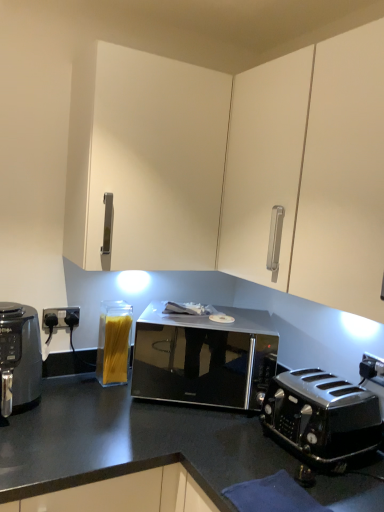
Question: Does white matte cabinet at upper center have a lesser height compared to clear glass container of spaghetti at lower left?

Choices:
 (A) no
 (B) yes

Answer: (A)

Question: Is white matte cabinet at upper center not inside clear glass container of spaghetti at lower left?

Choices:
 (A) no
 (B) yes

Answer: (B)

Question: From a real-world perspective, is white matte cabinet at upper center positioned over clear glass container of spaghetti at lower left based on gravity?

Choices:
 (A) yes
 (B) no

Answer: (A)

Question: Is white matte cabinet at upper center wider than clear glass container of spaghetti at lower left?

Choices:
 (A) no
 (B) yes

Answer: (B)

Question: Can you confirm if white matte cabinet at upper center is thinner than clear glass container of spaghetti at lower left?

Choices:
 (A) no
 (B) yes

Answer: (A)

Question: Is polished black toaster at lower right wider or thinner than black matte air fryer at left?

Choices:
 (A) thin
 (B) wide

Answer: (B)

Question: In terms of height, does polished black toaster at lower right look taller or shorter compared to black matte air fryer at left?

Choices:
 (A) short
 (B) tall

Answer: (A)

Question: From a real-world perspective, is polished black toaster at lower right above or below black matte air fryer at left?

Choices:
 (A) below
 (B) above

Answer: (A)

Question: From the image's perspective, is polished black toaster at lower right above or below black matte air fryer at left?

Choices:
 (A) above
 (B) below

Answer: (B)

Question: Is white matte cabinet at upper center in front of or behind polished black toaster at lower right in the image?

Choices:
 (A) behind
 (B) front

Answer: (A)

Question: Considering the relative positions of white matte cabinet at upper center and polished black toaster at lower right in the image provided, is white matte cabinet at upper center to the left or to the right of polished black toaster at lower right?

Choices:
 (A) left
 (B) right

Answer: (A)

Question: Based on their sizes in the image, would you say white matte cabinet at upper center is bigger or smaller than polished black toaster at lower right?

Choices:
 (A) big
 (B) small

Answer: (A)

Question: From a real-world perspective, is white matte cabinet at upper center physically located above or below polished black toaster at lower right?

Choices:
 (A) below
 (B) above

Answer: (B)

Question: Is black matte air fryer at left wider or thinner than black glossy microwave at center?

Choices:
 (A) wide
 (B) thin

Answer: (A)

Question: Choose the correct answer: Is black matte air fryer at left inside black glossy microwave at center or outside it?

Choices:
 (A) outside
 (B) inside

Answer: (A)